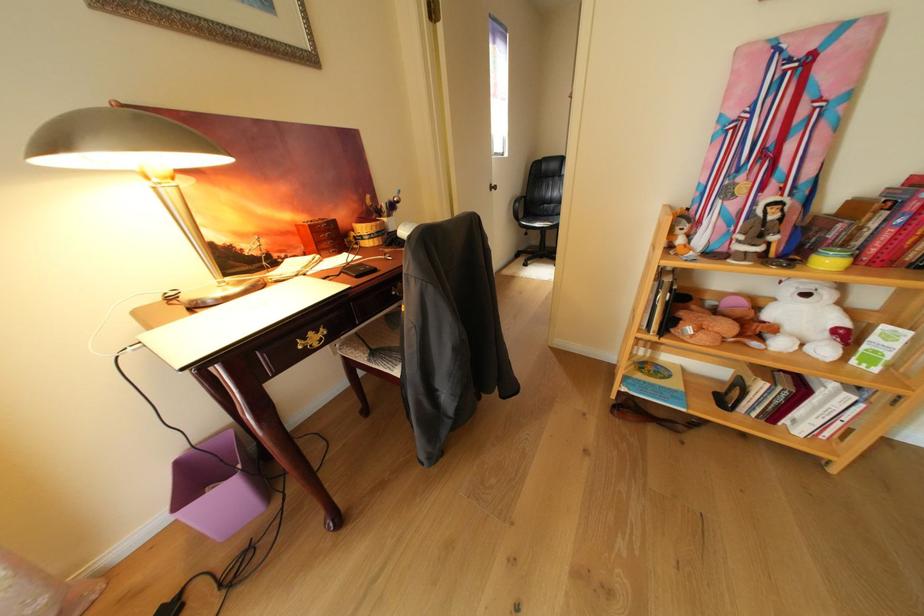
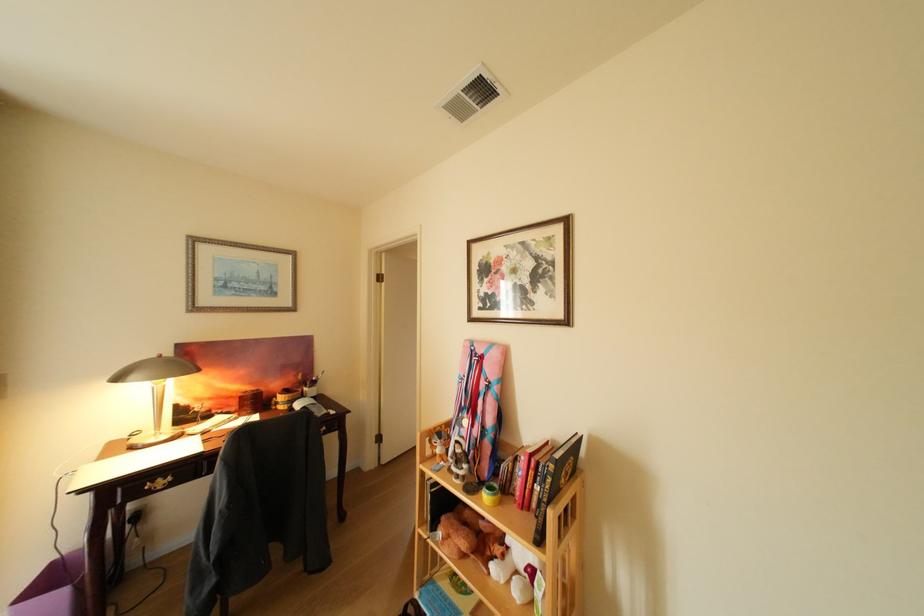
The point at (312, 349) is marked in the first image. Where is the corresponding point in the second image?

(160, 490)